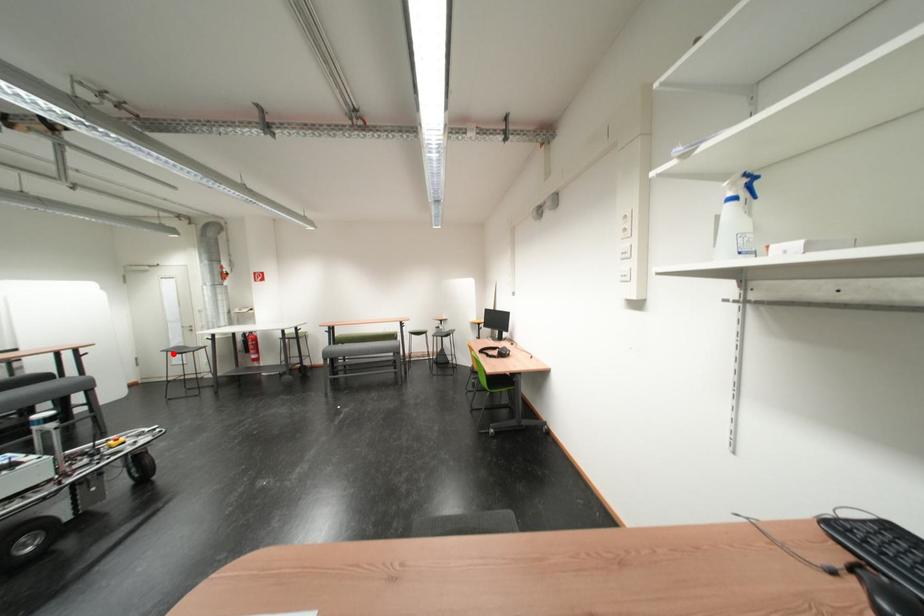
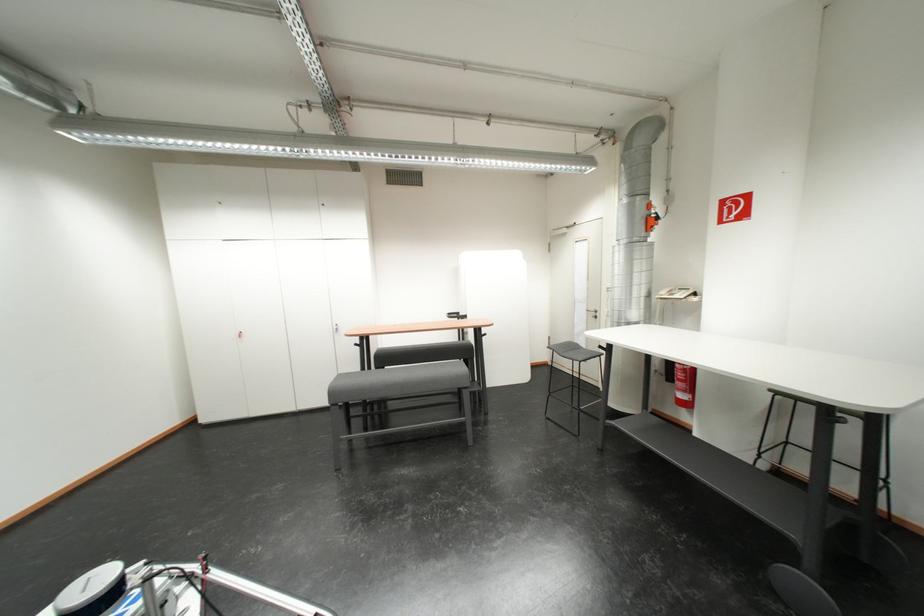
In the second image, find the point that corresponds to the highlighted location in the first image.

(560, 350)